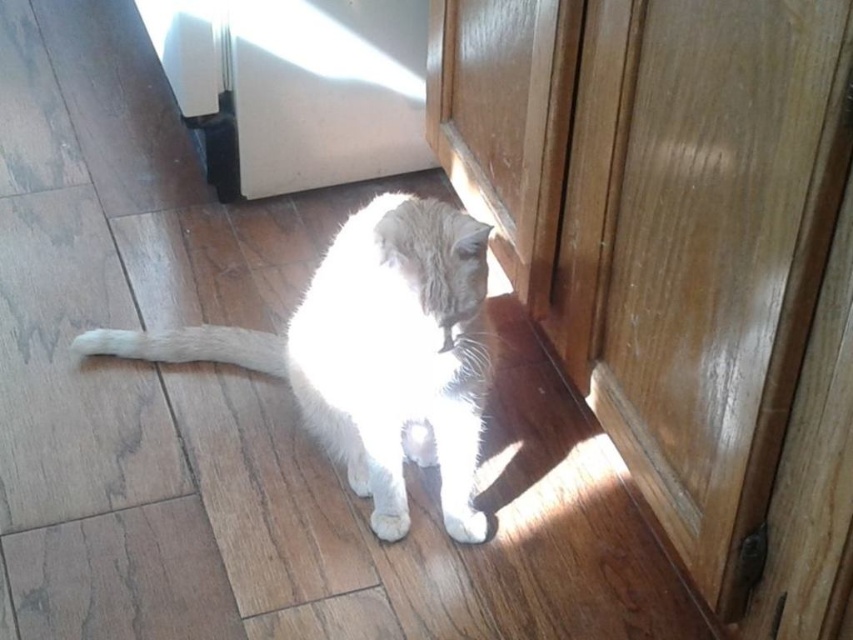
Question: Where is white fluffy cat at center located in relation to white fluffy tail at lower left in the image?

Choices:
 (A) left
 (B) right

Answer: (B)

Question: Does white fluffy cat at center appear under white fur paw at lower center?

Choices:
 (A) yes
 (B) no

Answer: (B)

Question: Which point is closer to the camera?

Choices:
 (A) (398, 538)
 (B) (445, 508)
 (C) (413, 346)

Answer: (C)

Question: Which point is closer to the camera taking this photo?

Choices:
 (A) (189, 340)
 (B) (402, 445)
 (C) (466, 506)

Answer: (C)

Question: Estimate the real-world distances between objects in this image. Which object is farther from the white fluffy paw at lower center?

Choices:
 (A) white fur paw at lower center
 (B) white fluffy tail at lower left

Answer: (B)

Question: Can you confirm if white fluffy cat at center is positioned above white fluffy paw at lower center?

Choices:
 (A) no
 (B) yes

Answer: (B)